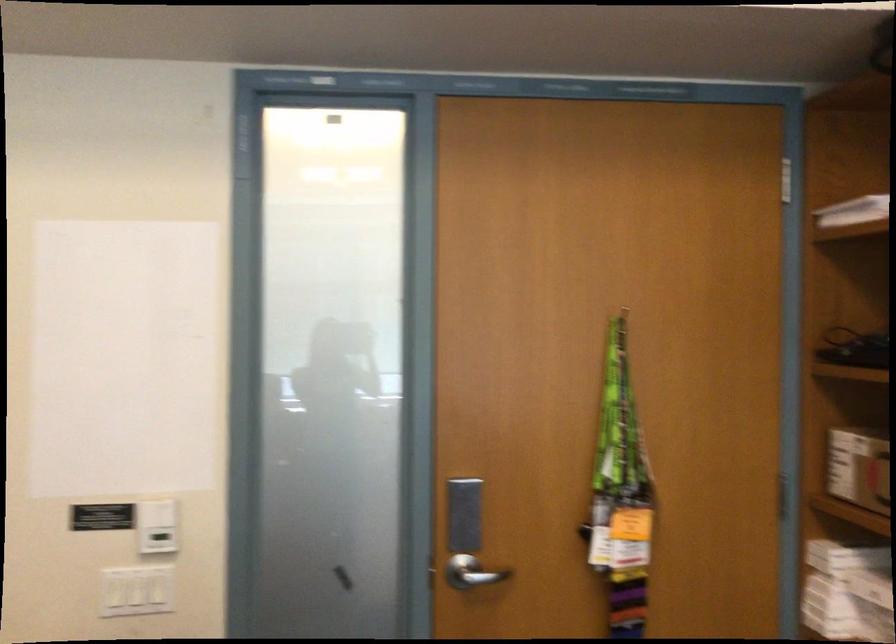
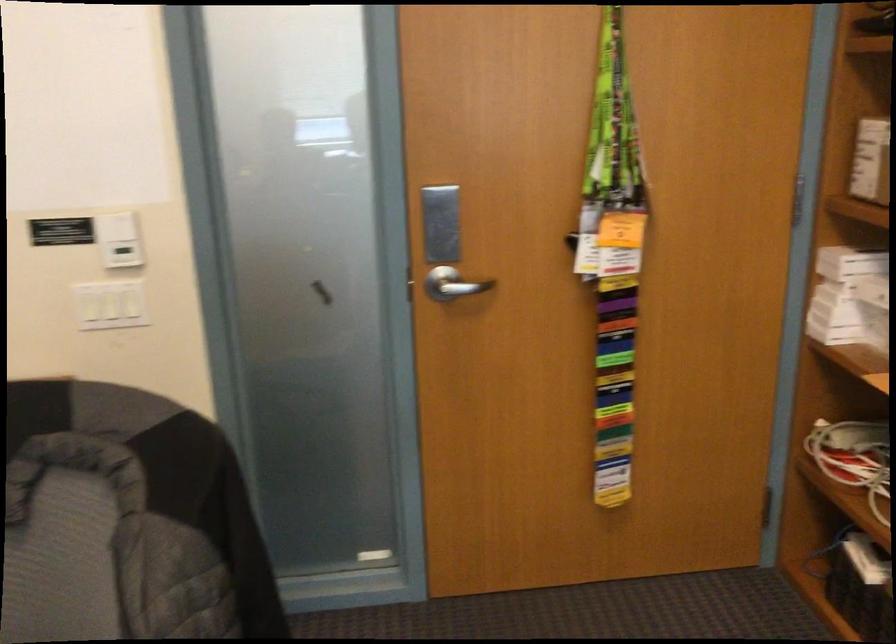
In a continuous first-person perspective shot, in which direction is the camera moving?

The cameraman moved toward right, forward.